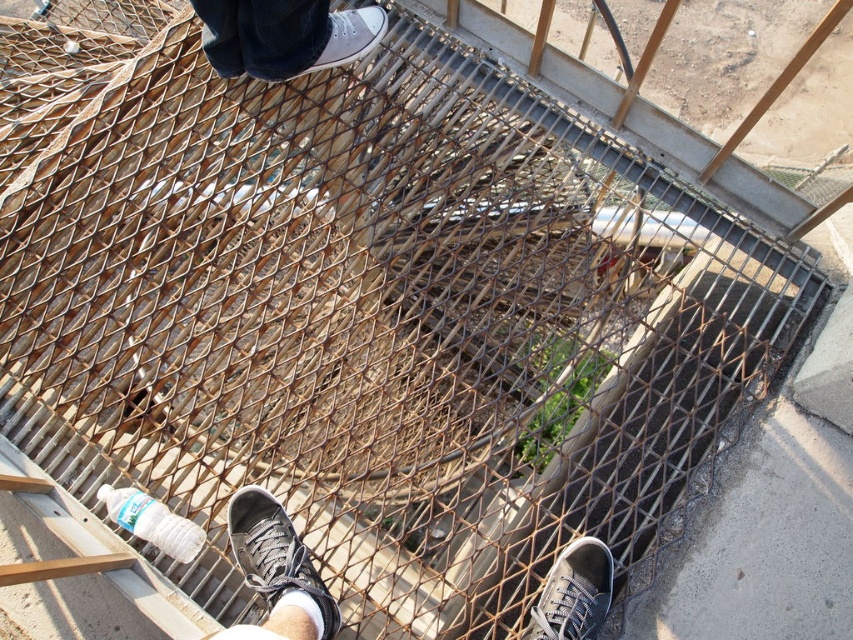
Question: Which point is farther to the camera?

Choices:
 (A) matte gray canvas shoe at upper center
 (B) matte gray sneaker at lower right

Answer: (A)

Question: Which object appears closest to the camera in this image?

Choices:
 (A) matte gray sneaker at lower right
 (B) matte gray canvas shoe at upper center

Answer: (A)

Question: Which object appears closest to the camera in this image?

Choices:
 (A) matte gray sneaker at lower right
 (B) matte gray sneaker at lower center

Answer: (A)

Question: Considering the relative positions of matte gray sneaker at lower center and matte gray canvas shoe at upper center in the image provided, where is matte gray sneaker at lower center located with respect to matte gray canvas shoe at upper center?

Choices:
 (A) right
 (B) left

Answer: (B)

Question: From the image, what is the correct spatial relationship of matte gray sneaker at lower center in relation to matte gray sneaker at lower right?

Choices:
 (A) right
 (B) left

Answer: (B)

Question: Does matte gray sneaker at lower right appear over matte gray canvas shoe at upper center?

Choices:
 (A) yes
 (B) no

Answer: (B)